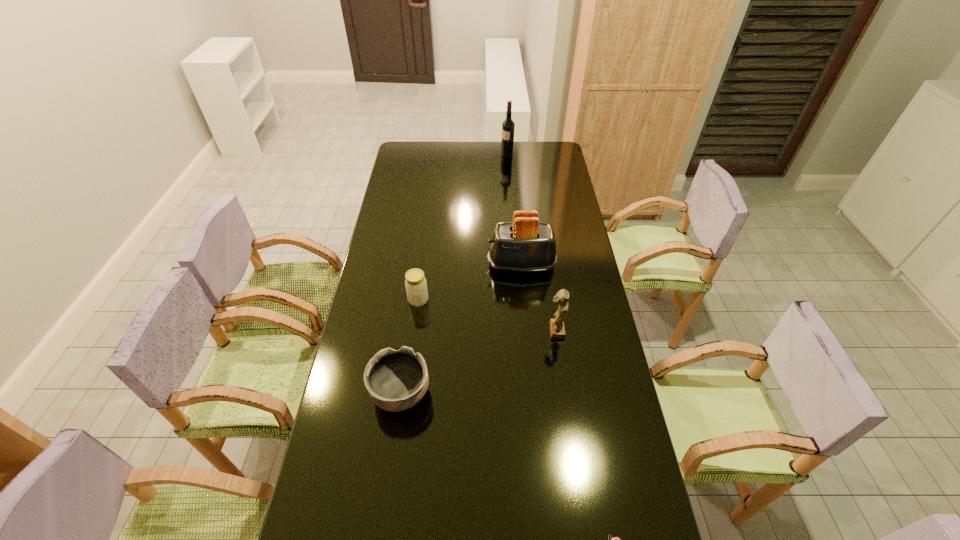
Identify the location of vacant space located on the side of the second tallest object with the control lever. The image size is (960, 540). (434, 265).

In order to click on vacant region located 0.260m on the side of the second tallest object with the control lever in this screenshot , I will do `click(421, 265)`.

Find the location of a particular element. The height and width of the screenshot is (540, 960). free point located on the side of the second tallest object with the control lever is located at coordinates (404, 265).

The width and height of the screenshot is (960, 540). Find the location of `vacant area located 0.210m on the front-facing side of the third nearest object`. vacant area located 0.210m on the front-facing side of the third nearest object is located at coordinates (487, 331).

The width and height of the screenshot is (960, 540). In order to click on vacant space located on the front-facing side of the third nearest object in this screenshot , I will do `click(495, 331)`.

At what (x,y) coordinates should I click in order to perform the action: click on vacant region located on the front-facing side of the third nearest object. Please return your answer as a coordinate pair (x, y). This screenshot has height=540, width=960. Looking at the image, I should click on (475, 331).

Locate an element on the screen. vacant region located on the front of the jar is located at coordinates (409, 370).

Identify the location of vacant area situated 0.190m on the front of the pottery. The width and height of the screenshot is (960, 540). (388, 490).

In order to click on object that is at the far edge in this screenshot , I will do `click(508, 126)`.

Where is `object that is at the left edge`? object that is at the left edge is located at coordinates 396,381.